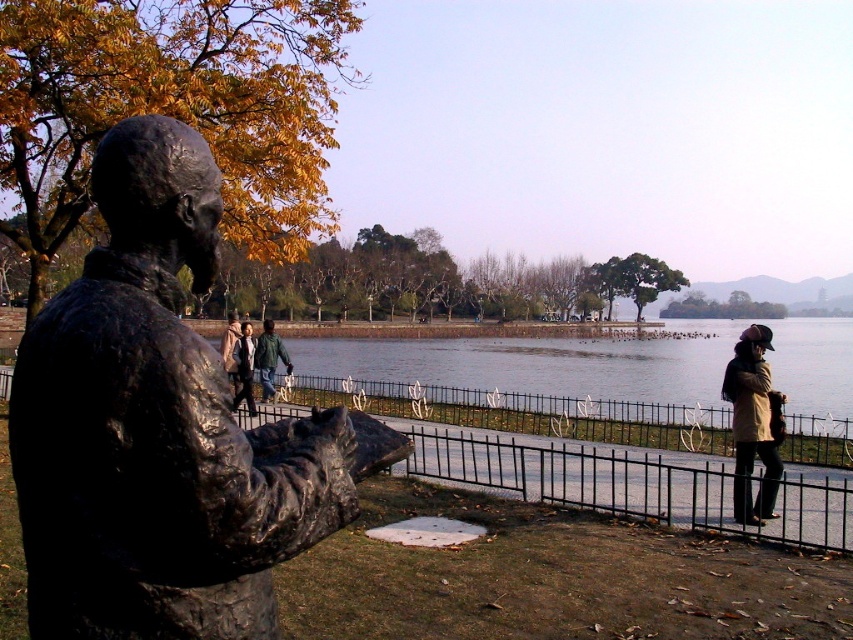
Question: Can you confirm if bronze statue at left is positioned above black metal fence at lower center?

Choices:
 (A) yes
 (B) no

Answer: (A)

Question: Estimate the real-world distances between objects in this image. Which object is closer to the green fabric jacket at center?

Choices:
 (A) matte black jacket at center
 (B) black metal fence at lower center

Answer: (A)

Question: Is tan leather jacket at lower right to the right of matte black jacket at center from the viewer's perspective?

Choices:
 (A) yes
 (B) no

Answer: (A)

Question: Does green fabric jacket at center have a greater width compared to matte black jacket at center?

Choices:
 (A) no
 (B) yes

Answer: (A)

Question: Which point is farther to the camera?

Choices:
 (A) bronze statue at left
 (B) tan leather jacket at lower right
 (C) black metal fence at lower center

Answer: (B)

Question: Which object is the farthest from the tan leather jacket at lower right?

Choices:
 (A) black metal fence at lower center
 (B) bronze statue at left
 (C) matte black jacket at center

Answer: (C)